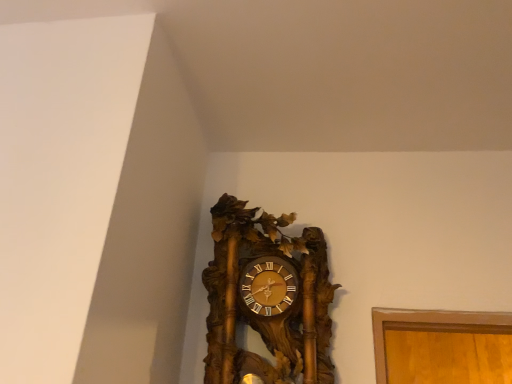
This screenshot has height=384, width=512. What do you see at coordinates (267, 297) in the screenshot?
I see `wooden carved clock at center` at bounding box center [267, 297].

In order to click on wooden carved clock at center in this screenshot , I will do `click(267, 297)`.

Locate an element on the screen. wooden carved clock at center is located at coordinates (267, 297).